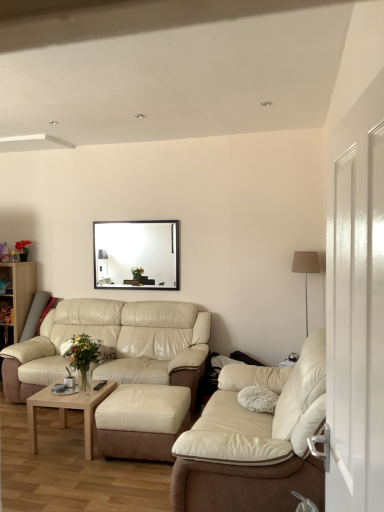
At what (x,y) coordinates should I click in order to perform the action: click on free space above suede ottoman at center (from a real-world perspective). Please return your answer as a coordinate pair (x, y). The image size is (384, 512). Looking at the image, I should click on (150, 390).